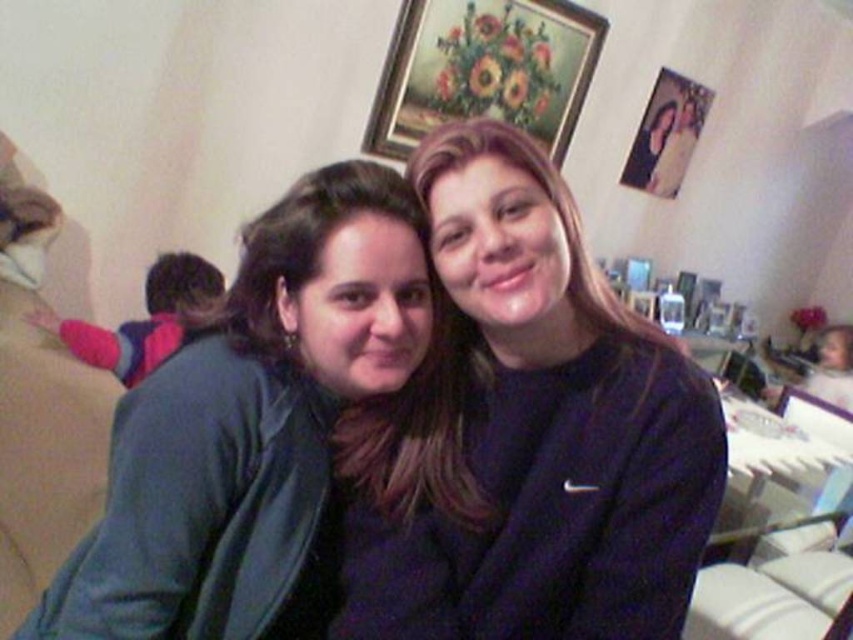
You are trying to decide whether to hang a new picture that is the same size as the matte green jacket at left on the wall where the matte wooden photo frame at upper right is currently placed. Based on their widths, will the new picture fit in the space without overlapping?

The matte green jacket at left has a lesser width compared to the matte wooden photo frame at upper right. Since the new picture is the same width as the jacket, it will fit in the space without overlapping.

You are an interior designer assessing the living room. You notice the matte green jacket at left and the wooden framed floral painting at upper center. Which object has a smaller width?

The matte green jacket at left has a smaller width than the wooden framed floral painting at upper center.

You are a delivery person who needs to place a small package between the pink fleece jacket at left and the matte wooden photo frame at upper right. Can you fit the package in the space between them?

The distance between the pink fleece jacket at left and the matte wooden photo frame at upper right is 9.98 feet, so yes, the package can fit in the space between them as there is sufficient distance.